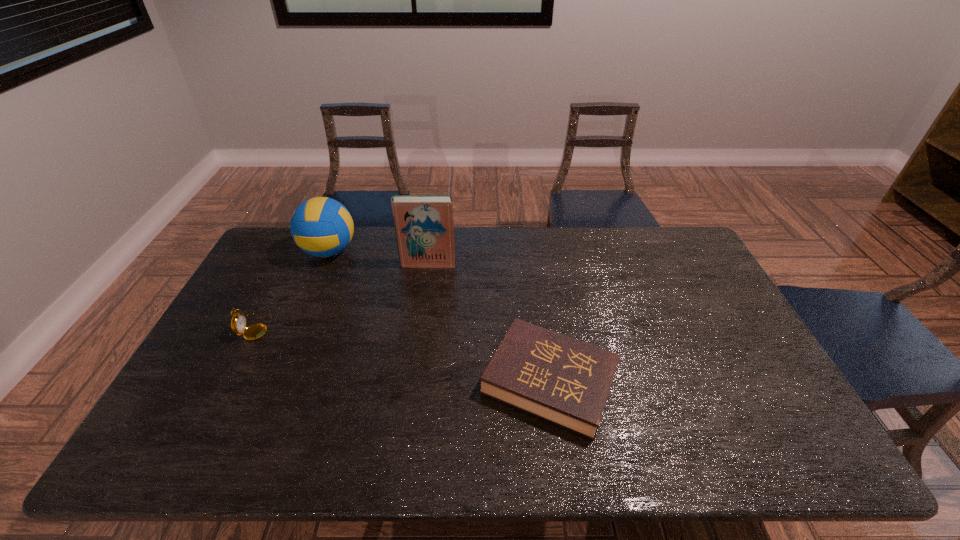
Locate an element on the screen. This screenshot has width=960, height=540. hardback book that is at the far edge is located at coordinates (424, 229).

Where is `volleyball located in the far edge section of the desktop`? volleyball located in the far edge section of the desktop is located at coordinates (322, 227).

Where is `object positioned at the near edge`? object positioned at the near edge is located at coordinates (565, 381).

Identify the location of volleyball at the left edge. (322, 227).

The image size is (960, 540). What are the coordinates of `pocket watch present at the left edge` in the screenshot? It's located at (238, 322).

Locate an element on the screen. This screenshot has height=540, width=960. object that is positioned at the far left corner is located at coordinates (322, 227).

Locate an element on the screen. This screenshot has height=540, width=960. vacant space at the far edge of the desktop is located at coordinates (490, 234).

In the image, there is a desktop. At what (x,y) coordinates should I click in order to perform the action: click on vacant space at the near edge. Please return your answer as a coordinate pair (x, y). The height and width of the screenshot is (540, 960). Looking at the image, I should click on (248, 457).

In the image, there is a desktop. Where is `blank space at the right edge`? blank space at the right edge is located at coordinates (740, 413).

Where is `vacant area at the far left corner of the desktop`? This screenshot has width=960, height=540. vacant area at the far left corner of the desktop is located at coordinates (306, 258).